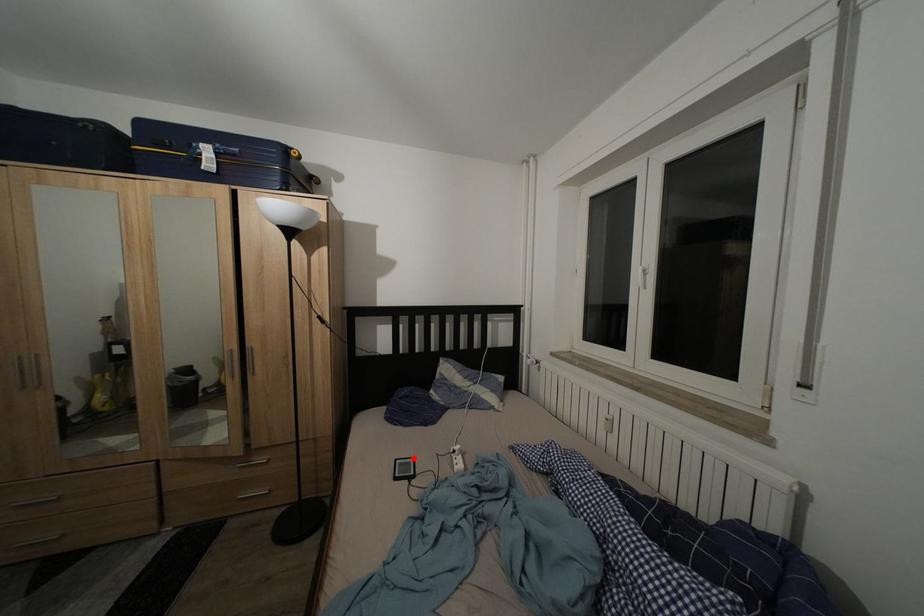
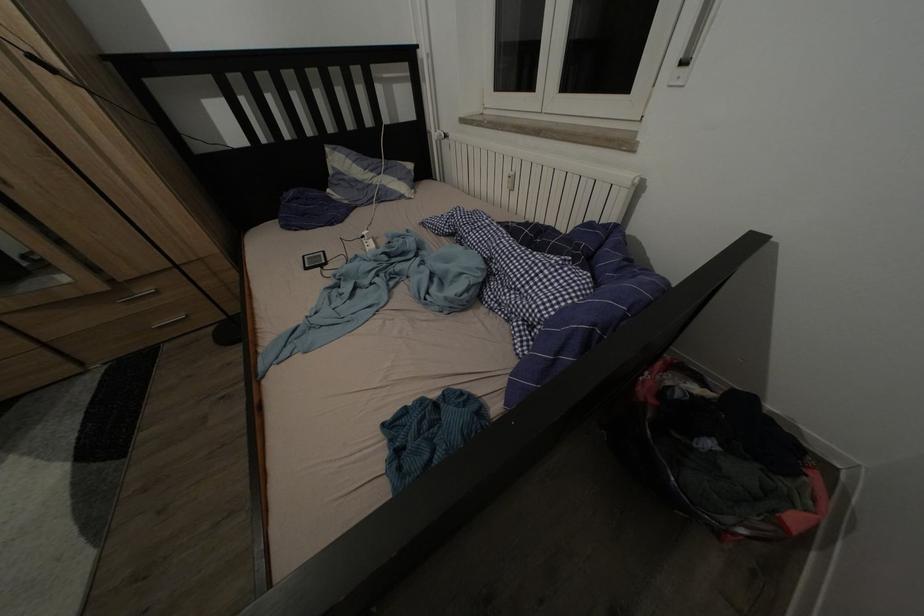
In the second image, find the point that corresponds to the highlighted location in the first image.

(320, 254)